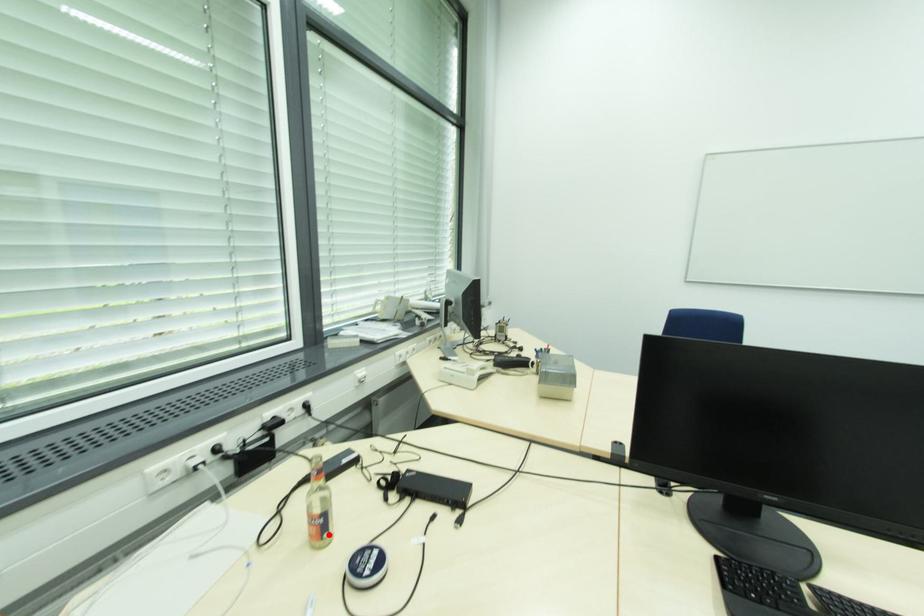
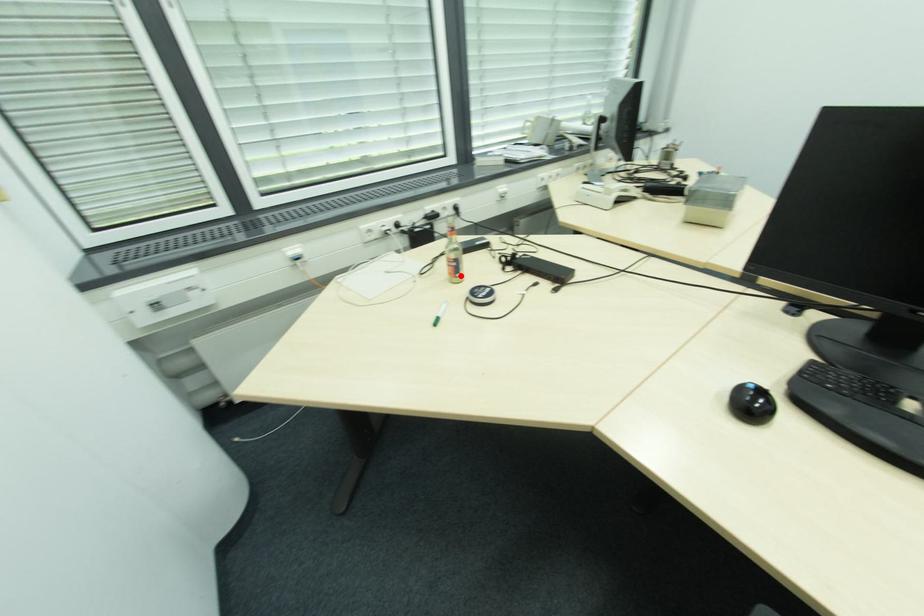
I am providing you with two images of the same scene from different viewpoints. A red point is marked on the first image and another point is marked on the second image. Are the points marked in image1 and image2 representing the same 3D position?

Yes